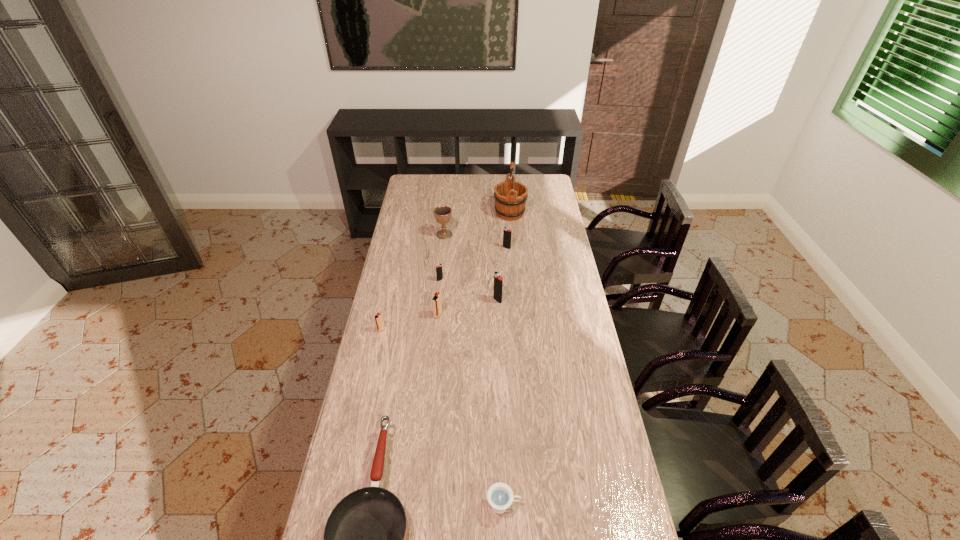
You are a GUI agent. You are given a task and a screenshot of the screen. Output one action in this format:
    pyautogui.click(x=<x>, y=<y>)
    Task: Click on the nearer red igniter
    This screenshot has width=960, height=540.
    Given the screenshot: What is the action you would take?
    pyautogui.click(x=379, y=322)

Where is `the third nearest object`? This screenshot has width=960, height=540. the third nearest object is located at coordinates (379, 322).

Where is `the second farthest black igniter`? The image size is (960, 540). the second farthest black igniter is located at coordinates (439, 274).

Find the location of a particular element. The width and height of the screenshot is (960, 540). the fourth farthest object is located at coordinates (439, 274).

This screenshot has height=540, width=960. In order to click on the shortest object in this screenshot , I will do `click(500, 496)`.

At what (x,y) coordinates should I click in order to perform the action: click on teacup. Please return your answer as a coordinate pair (x, y). This screenshot has height=540, width=960. Looking at the image, I should click on (500, 496).

Locate an element on the screen. The width and height of the screenshot is (960, 540). vacant space situated 0.330m on the back of the tallest object is located at coordinates (506, 174).

Locate an element on the screen. free space located 0.100m on the back of the biggest black igniter is located at coordinates (496, 281).

Locate an element on the screen. This screenshot has height=540, width=960. free space located 0.310m on the back of the chalice is located at coordinates (448, 197).

This screenshot has height=540, width=960. I want to click on blank area located 0.340m on the front of the third farthest object, so [511, 299].